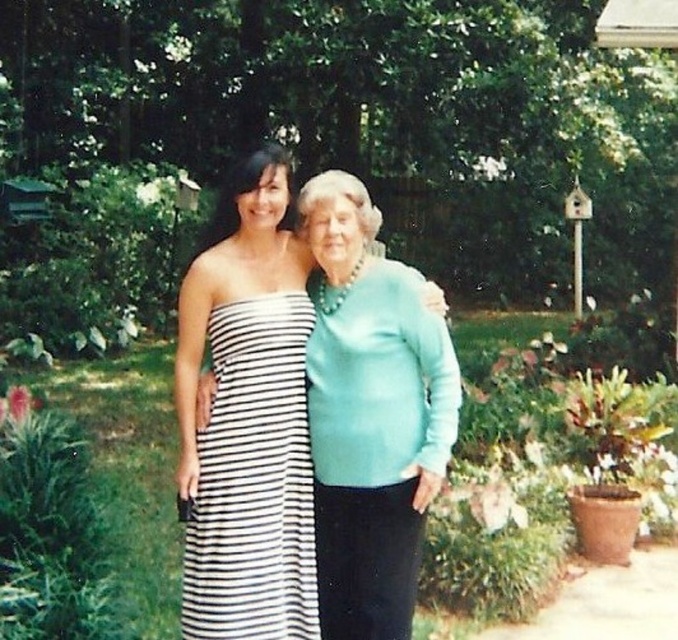
Question: From the image, what is the correct spatial relationship of teal satin blouse at center in relation to black and white striped dress at center?

Choices:
 (A) left
 (B) right

Answer: (B)

Question: Which object is closer to the camera taking this photo?

Choices:
 (A) teal satin blouse at center
 (B) black and white striped dress at center

Answer: (A)

Question: Can you confirm if teal satin blouse at center is bigger than black and white striped dress at center?

Choices:
 (A) yes
 (B) no

Answer: (A)

Question: Considering the relative positions of teal satin blouse at center and black and white striped dress at center in the image provided, where is teal satin blouse at center located with respect to black and white striped dress at center?

Choices:
 (A) left
 (B) right

Answer: (B)